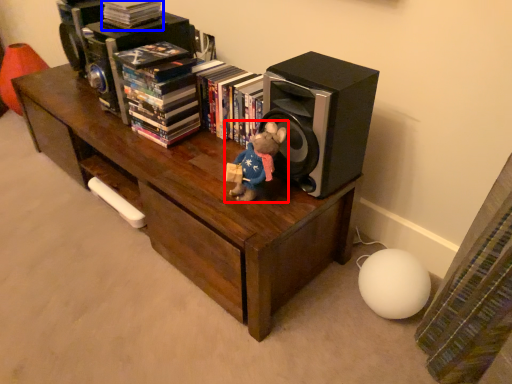
Question: Among these objects, which one is nearest to the camera, toy (highlighted by a red box) or book (highlighted by a blue box)?

Choices:
 (A) toy
 (B) book

Answer: (A)